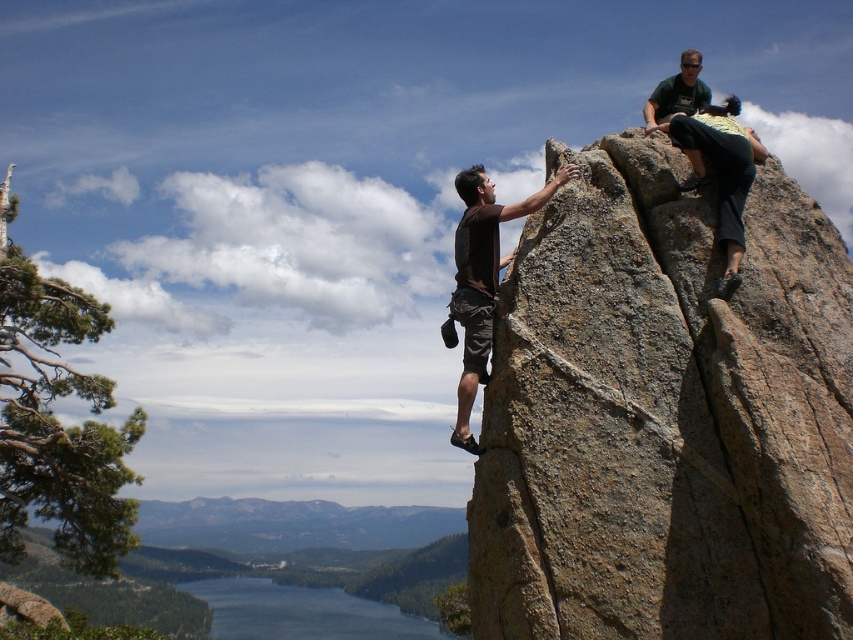
Question: Can you confirm if brown rock at upper right is positioned to the left of brown matte shorts at center?

Choices:
 (A) no
 (B) yes

Answer: (A)

Question: Which of these objects is positioned closest to the brown matte shorts at center?

Choices:
 (A) blue glassy water at lower left
 (B) green fabric shirt at upper right

Answer: (B)

Question: Which point is closer to the camera?

Choices:
 (A) click(320, 609)
 (B) click(671, 83)
 (C) click(625, 189)

Answer: (C)

Question: Which point is farther to the camera?

Choices:
 (A) (701, 81)
 (B) (225, 634)
 (C) (611, 360)
 (D) (485, 209)

Answer: (B)

Question: Does brown rock at upper right have a smaller size compared to brown matte shorts at center?

Choices:
 (A) yes
 (B) no

Answer: (B)

Question: Can you confirm if blue glassy water at lower left is smaller than brown matte shorts at center?

Choices:
 (A) no
 (B) yes

Answer: (A)